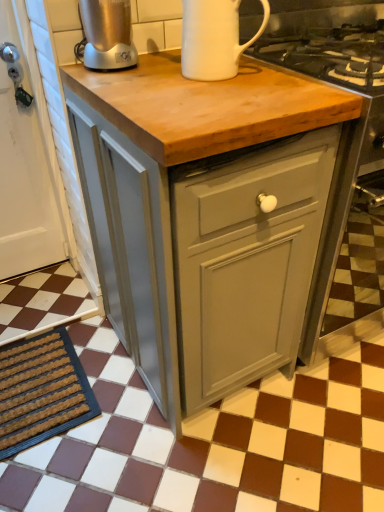
This screenshot has height=512, width=384. Find the location of `empty space that is to the right of brushed metal blender at upper left, which is the 1th kitchen appliance from left to right`. empty space that is to the right of brushed metal blender at upper left, which is the 1th kitchen appliance from left to right is located at coordinates (160, 61).